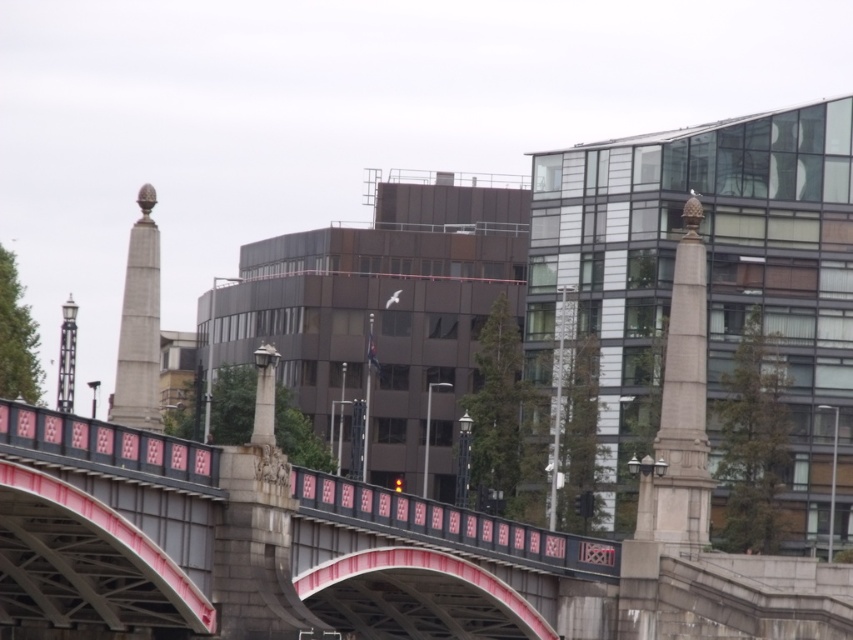
You are a city planner reviewing a design for a new urban area. The design includes a metallic bridge at center and a smooth stone obelisk at left. Based on the provided scene, which object is located to the left of the other?

The smooth stone obelisk at left is located to the left of the metallic bridge at center.

You are standing on the bridge and want to take a photo. You notice two points marked on the bridge railing. The first point is at coordinate point [207,554] and the second at point [126,420]. Which point will appear larger in your photo?

Point [207,554] is closer to the camera than point [126,420], so it will appear larger in the photo.

You are a city planner reviewing a blueprint of the urban area. The metallic bridge at center is positioned at coordinates 0.883, 0.503. If you need to place a new public bench near this bridge, ensuring it is within a 0.1 radius from its current location, where should you place it?

The metallic bridge at center is located at point (428, 564). To place the bench within a 0.1 radius, it should be positioned between coordinates 0.783 to 0.983 along the x and 0.403 to 0.603 along the y axis.